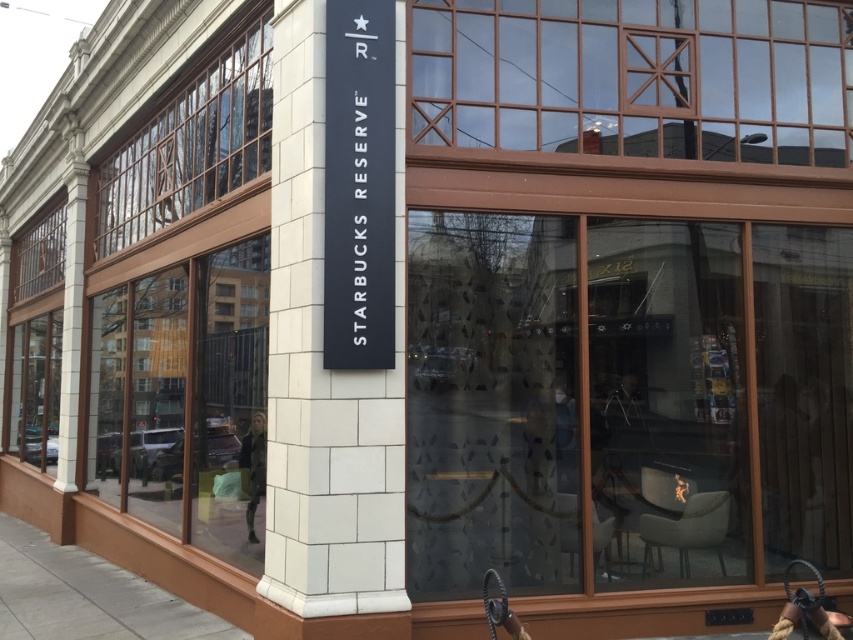
Is gray concrete pavement at lower left thinner than green fabric jacket at center?

No, gray concrete pavement at lower left is not thinner than green fabric jacket at center.

Can you confirm if gray concrete pavement at lower left is positioned below green fabric jacket at center?

Yes, gray concrete pavement at lower left is below green fabric jacket at center.

What do you see at coordinates (86, 595) in the screenshot?
I see `gray concrete pavement at lower left` at bounding box center [86, 595].

At what (x,y) coordinates should I click in order to perform the action: click on gray concrete pavement at lower left. Please return your answer as a coordinate pair (x, y). The image size is (853, 640). Looking at the image, I should click on (86, 595).